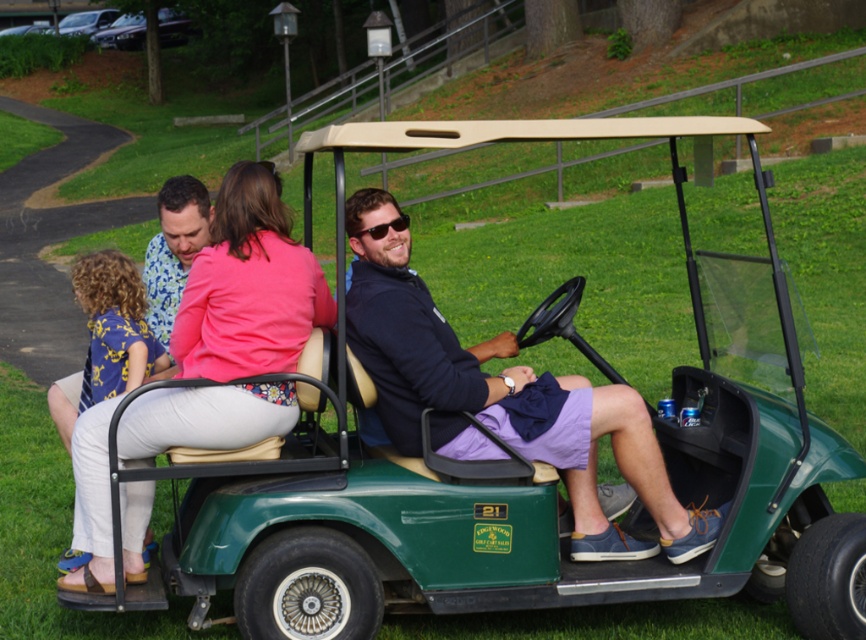
You are a delivery robot with a 1.2 meter width. You need to deliver a package to the golf cart driver. Can you fit through the space between the blue floral dress at left and the sunglasses at center?

The space between the blue floral dress at left and sunglasses at center is 1.22 meters. Since the robot is 1.2 meters wide, it can fit through the space as it is slightly narrower than the available distance.

What is the spatial relationship between the pink fabric shirt at upper center and the point at coordinates (249, 285)?

The pink fabric shirt at upper center is represented by the point at coordinates (249, 285).

Based on the scene description, which object is bigger between the pink fabric shirt at upper center and the sunglasses at center?

The pink fabric shirt at upper center is larger in size compared to the sunglasses at center.